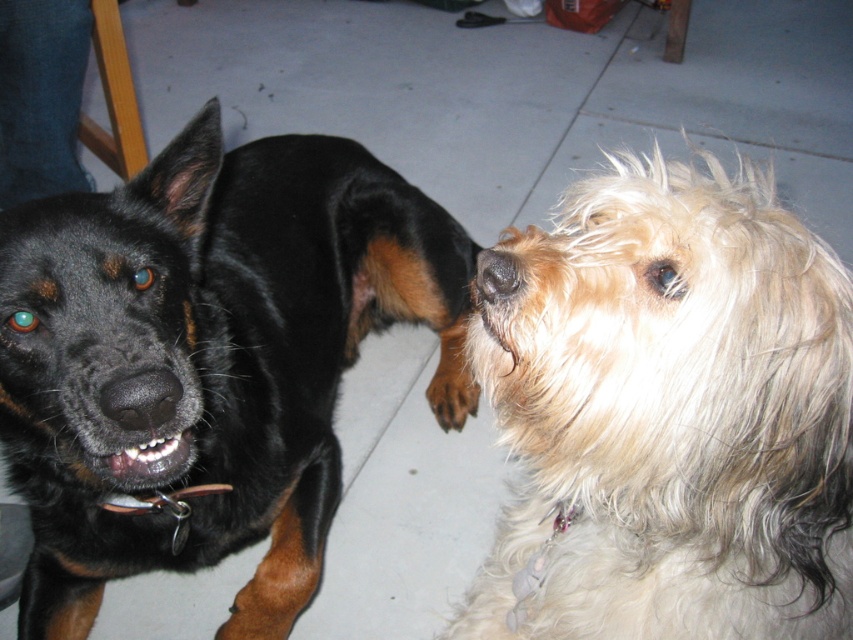
Question: Which point is closer to the camera?

Choices:
 (A) black matte nose at center
 (B) black glossy fur dog at left
 (C) brown fuzzy nose at center
 (D) brown fur paw at center

Answer: (C)

Question: Which of these objects is positioned closest to the brown fuzzy nose at center?

Choices:
 (A) black glossy fur dog at left
 (B) brown fur paw at center

Answer: (A)

Question: Which object appears farthest from the camera in this image?

Choices:
 (A) black matte nose at center
 (B) black glossy fur dog at left
 (C) brown fuzzy nose at center
 (D) brown fur paw at center

Answer: (D)

Question: Is fluffy beige dog at right to the left of brown fur paw at center from the viewer's perspective?

Choices:
 (A) no
 (B) yes

Answer: (A)

Question: Can you confirm if black glossy fur dog at left is positioned to the right of brown fuzzy nose at center?

Choices:
 (A) no
 (B) yes

Answer: (A)

Question: Is black matte nose at center to the left of brown fur paw at center from the viewer's perspective?

Choices:
 (A) no
 (B) yes

Answer: (B)